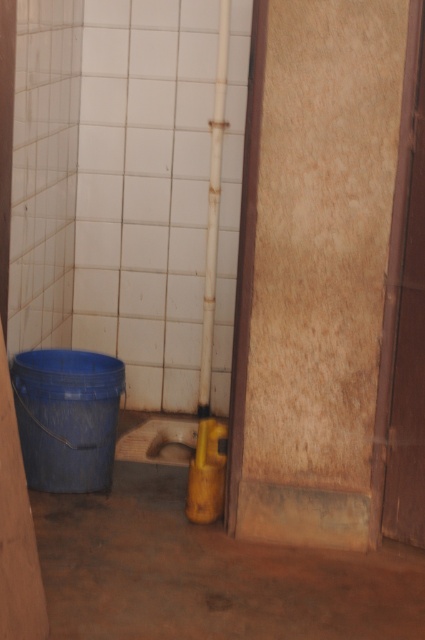
Which is below, blue plastic bucket at lower left or yellow matte barrel at lower center?

yellow matte barrel at lower center

Between point (102, 452) and point (218, 515), which one is positioned behind?

The point (102, 452) is behind.

Is point (105, 429) in front of point (204, 436)?

No, it is not.

Image resolution: width=425 pixels, height=640 pixels. I want to click on blue plastic bucket at lower left, so click(x=67, y=417).